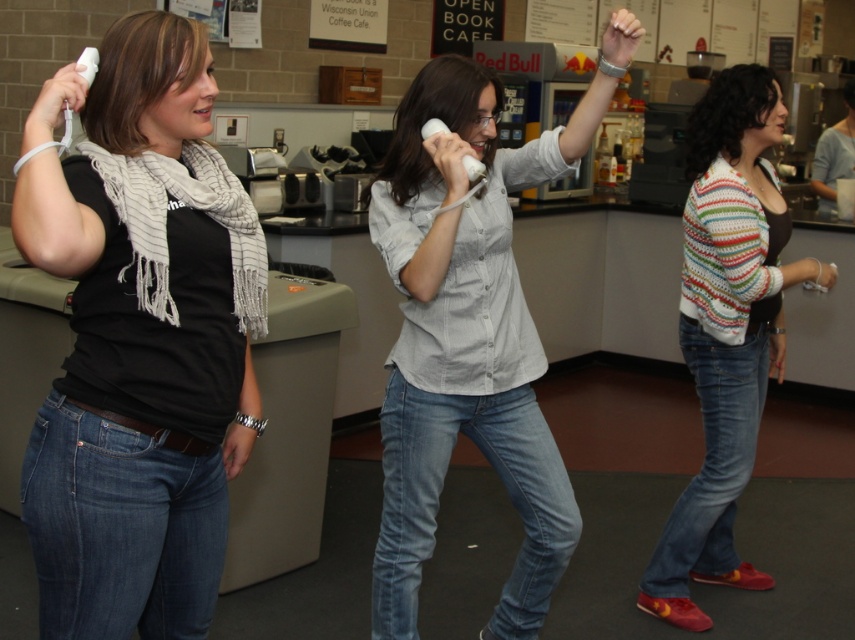
Question: Which object appears farthest from the camera in this image?

Choices:
 (A) black matte scarf at left
 (B) striped knit sweater at right

Answer: (B)

Question: Is black matte scarf at left above striped knit sweater at right?

Choices:
 (A) yes
 (B) no

Answer: (A)

Question: Which object is the farthest from the striped knit sweater at right?

Choices:
 (A) black matte scarf at left
 (B) denim jeans at center

Answer: (A)

Question: Is black matte scarf at left below striped knit sweater at right?

Choices:
 (A) yes
 (B) no

Answer: (B)

Question: Among these points, which one is farthest from the camera?

Choices:
 (A) (68, 401)
 (B) (771, 225)

Answer: (B)

Question: Does black matte scarf at left appear on the right side of striped knit sweater at right?

Choices:
 (A) yes
 (B) no

Answer: (B)